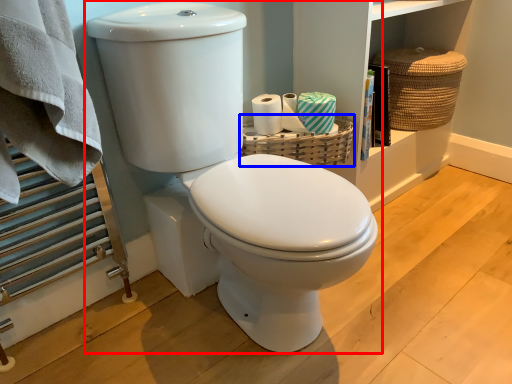
Question: Which of the following is the farthest to the observer, toilet (highlighted by a red box) or basket (highlighted by a blue box)?

Choices:
 (A) toilet
 (B) basket

Answer: (B)